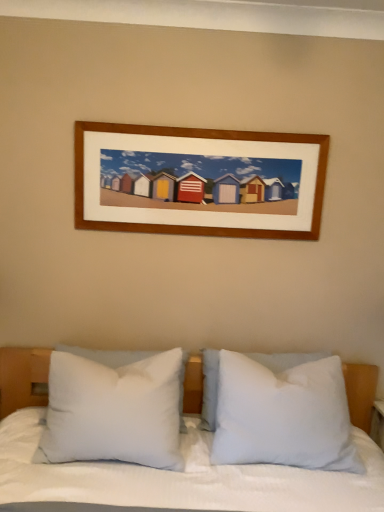
Locate an element on the screen. The height and width of the screenshot is (512, 384). white soft pillow at center, the 1th pillow when ordered from left to right is located at coordinates (113, 411).

Is white soft pillow at center, the third pillow positioned from the right, shorter than white soft pillow at center, arranged as the 2th pillow when viewed from the left?

Incorrect, the height of white soft pillow at center, the third pillow positioned from the right, does not fall short of that of white soft pillow at center, arranged as the 2th pillow when viewed from the left.

From a real-world perspective, who is located lower, white soft pillow at center, the third pillow positioned from the right, or white soft pillow at center, arranged as the 2th pillow when viewed from the left?

From a 3D spatial view, white soft pillow at center, arranged as the 2th pillow when viewed from the left, is below.

Considering the sizes of objects white soft pillow at center, the third pillow positioned from the right, and white soft pillow at center, the 2th pillow positioned from the right, in the image provided, who is bigger, white soft pillow at center, the third pillow positioned from the right, or white soft pillow at center, the 2th pillow positioned from the right,?

With larger size is white soft pillow at center, the third pillow positioned from the right.

Do you think white soft pillow at center, the third pillow positioned from the right, is within white soft pillow at center, the 1th pillow in the right-to-left sequence, or outside of it?

white soft pillow at center, the third pillow positioned from the right, is not inside white soft pillow at center, the 1th pillow in the right-to-left sequence, it's outside.

From a real-world perspective, between white soft pillow at center, the 1th pillow when ordered from left to right, and white soft pillow at center, the 1th pillow in the right-to-left sequence, who is vertically lower?

From a 3D spatial view, white soft pillow at center, the 1th pillow in the right-to-left sequence, is below.

From the image's perspective, is white soft pillow at center, the third pillow positioned from the right, positioned above or below white soft pillow at center, the 1th pillow in the right-to-left sequence?

From the image's perspective, white soft pillow at center, the third pillow positioned from the right, appears above white soft pillow at center, the 1th pillow in the right-to-left sequence.

In the image, is white soft pillow at center, the 1th pillow when ordered from left to right, on the left side or the right side of white soft pillow at center, arranged as the 3th pillow when viewed from the left?

In the image, white soft pillow at center, the 1th pillow when ordered from left to right, appears on the left side of white soft pillow at center, arranged as the 3th pillow when viewed from the left.

Is white soft pillow at center, arranged as the 3th pillow when viewed from the left, bigger than white soft pillow at center, the third pillow positioned from the right?

Yes, white soft pillow at center, arranged as the 3th pillow when viewed from the left, is bigger than white soft pillow at center, the third pillow positioned from the right.

Can you confirm if white soft pillow at center, arranged as the 3th pillow when viewed from the left, is positioned to the left of white soft pillow at center, the third pillow positioned from the right?

No.

From the image's perspective, between white soft pillow at center, arranged as the 3th pillow when viewed from the left, and white soft pillow at center, the third pillow positioned from the right, which one is located above?

white soft pillow at center, the third pillow positioned from the right, from the image's perspective.

Where is `the 1st pillow behind the white soft pillow at center, the third pillow positioned from the right, counting from the anchor's position`? the 1st pillow behind the white soft pillow at center, the third pillow positioned from the right, counting from the anchor's position is located at coordinates [x=283, y=415].

Does white soft pillow at center, the 2th pillow positioned from the right, turn towards white soft pillow at center, the 1th pillow in the right-to-left sequence?

Yes, white soft pillow at center, the 2th pillow positioned from the right, faces towards white soft pillow at center, the 1th pillow in the right-to-left sequence.

Which object is closer to the camera, white soft pillow at center, the 2th pillow positioned from the right, or white soft pillow at center, the 1th pillow in the right-to-left sequence?

white soft pillow at center, the 1th pillow in the right-to-left sequence, is closer to the camera.

From the image's perspective, which one is positioned lower, white soft pillow at center, arranged as the 2th pillow when viewed from the left, or white soft pillow at center, the 1th pillow in the right-to-left sequence?

From the image's view, white soft pillow at center, the 1th pillow in the right-to-left sequence, is below.

Is white soft pillow at center, arranged as the 2th pillow when viewed from the left, not near white soft pillow at center, the third pillow positioned from the right?

That's not correct — white soft pillow at center, arranged as the 2th pillow when viewed from the left, is a little close to white soft pillow at center, the third pillow positioned from the right.

Consider the image. Is white soft pillow at center, the third pillow positioned from the right, a part of white soft pillow at center, the 2th pillow positioned from the right?

No, white soft pillow at center, the third pillow positioned from the right, is not inside white soft pillow at center, the 2th pillow positioned from the right.

Considering the relative positions of white soft pillow at center, the 2th pillow positioned from the right, and white soft pillow at center, the 1th pillow when ordered from left to right, in the image provided, is white soft pillow at center, the 2th pillow positioned from the right, behind white soft pillow at center, the 1th pillow when ordered from left to right,?

Yes, it is.

From a real-world perspective, is white soft pillow at center, arranged as the 2th pillow when viewed from the left, above or below white soft pillow at center, the 1th pillow when ordered from left to right?

In terms of real-world spatial position, white soft pillow at center, arranged as the 2th pillow when viewed from the left, is below white soft pillow at center, the 1th pillow when ordered from left to right.

Based on their positions, is white soft pillow at center, arranged as the 3th pillow when viewed from the left, located to the left or right of white soft pillow at center, the 2th pillow positioned from the right?

white soft pillow at center, arranged as the 3th pillow when viewed from the left, is to the right of white soft pillow at center, the 2th pillow positioned from the right.

From the image's perspective, which one is positioned higher, white soft pillow at center, arranged as the 3th pillow when viewed from the left, or white soft pillow at center, the 2th pillow positioned from the right?

white soft pillow at center, the 2th pillow positioned from the right, is shown above in the image.

Where is `the 1st pillow above when counting from the white soft pillow at center, the 1th pillow in the right-to-left sequence (from the image's perspective)`? the 1st pillow above when counting from the white soft pillow at center, the 1th pillow in the right-to-left sequence (from the image's perspective) is located at coordinates (210, 389).

Is white soft pillow at center, arranged as the 3th pillow when viewed from the left, smaller than white soft pillow at center, arranged as the 2th pillow when viewed from the left?

Incorrect, white soft pillow at center, arranged as the 3th pillow when viewed from the left, is not smaller in size than white soft pillow at center, arranged as the 2th pillow when viewed from the left.

Identify the location of pillow that is the 2nd one above the white soft pillow at center, the 2th pillow positioned from the right (from a real-world perspective). (113, 411).

Locate an element on the screen. Image resolution: width=384 pixels, height=512 pixels. pillow that is the 2nd one when counting upward from the white soft pillow at center, arranged as the 3th pillow when viewed from the left (from the image's perspective) is located at coordinates (113, 411).

Based on the photo, when comparing their distances from white soft pillow at center, the third pillow positioned from the right, does white soft pillow at center, the 1th pillow in the right-to-left sequence, or white soft pillow at center, the 2th pillow positioned from the right, seem closer?

Based on the image, white soft pillow at center, the 1th pillow in the right-to-left sequence, appears to be nearer to white soft pillow at center, the third pillow positioned from the right.

Which object lies nearer to the anchor point white soft pillow at center, the third pillow positioned from the right, white soft pillow at center, arranged as the 2th pillow when viewed from the left, or white soft pillow at center, arranged as the 3th pillow when viewed from the left?

white soft pillow at center, arranged as the 3th pillow when viewed from the left, is positioned closer to the anchor white soft pillow at center, the third pillow positioned from the right.

From the image, which object appears to be farther from white soft pillow at center, arranged as the 2th pillow when viewed from the left, white soft pillow at center, the 1th pillow in the right-to-left sequence, or white soft pillow at center, the 1th pillow when ordered from left to right?

Based on the image, white soft pillow at center, the 1th pillow when ordered from left to right, appears to be further to white soft pillow at center, arranged as the 2th pillow when viewed from the left.

When comparing their distances from white soft pillow at center, arranged as the 3th pillow when viewed from the left, does white soft pillow at center, the 1th pillow when ordered from left to right, or white soft pillow at center, the 2th pillow positioned from the right, seem closer?

white soft pillow at center, the 2th pillow positioned from the right.

Based on their spatial positions, is white soft pillow at center, arranged as the 2th pillow when viewed from the left, or white soft pillow at center, the 1th pillow when ordered from left to right, closer to white soft pillow at center, arranged as the 3th pillow when viewed from the left?

Based on the image, white soft pillow at center, arranged as the 2th pillow when viewed from the left, appears to be nearer to white soft pillow at center, arranged as the 3th pillow when viewed from the left.

Estimate the real-world distances between objects in this image. Which object is further from white soft pillow at center, arranged as the 2th pillow when viewed from the left, white soft pillow at center, the third pillow positioned from the right, or white soft pillow at center, arranged as the 3th pillow when viewed from the left?

Based on the image, white soft pillow at center, the third pillow positioned from the right, appears to be further to white soft pillow at center, arranged as the 2th pillow when viewed from the left.

Find the location of a particular element. pillow between white soft pillow at center, the third pillow positioned from the right, and white soft pillow at center, arranged as the 3th pillow when viewed from the left is located at coordinates tap(210, 389).